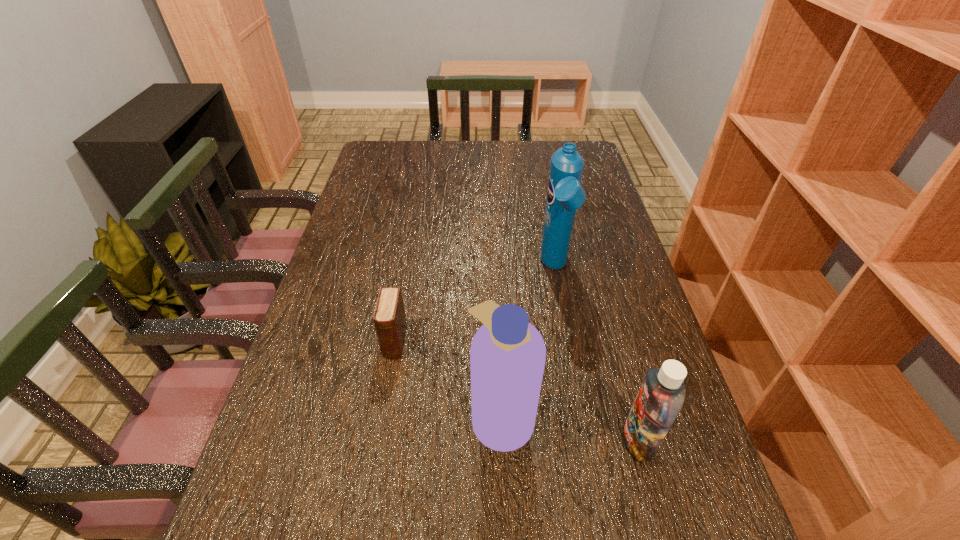
Locate an element on the screen. The image size is (960, 540). vacant area that lies between the shortest shampoo and the second shampoo from left to right is located at coordinates (596, 354).

This screenshot has width=960, height=540. In order to click on empty location between the third tallest object and the farthest object in this screenshot , I will do `click(596, 354)`.

In order to click on vacant space that is in between the rightmost shampoo and the leftmost shampoo in this screenshot , I will do `click(570, 428)`.

What are the coordinates of `free space between the shortest shampoo and the second object from right to left` in the screenshot? It's located at (596, 354).

You are a GUI agent. You are given a task and a screenshot of the screen. Output one action in this format:
    pyautogui.click(x=<x>, y=<y>)
    Task: Click on the empty location between the rightmost object and the farthest shampoo
    
    Given the screenshot: What is the action you would take?
    pyautogui.click(x=596, y=354)

Find the location of a particular element. The image size is (960, 540). vacant space in between the third object from right to left and the diary is located at coordinates (448, 379).

I want to click on blank region between the rightmost shampoo and the second object from left to right, so click(x=570, y=428).

Select which object is the third closest to the second object from right to left. Please provide its 2D coordinates. Your answer should be formatted as a tuple, i.e. [(x, y)], where the tuple contains the x and y coordinates of a point satisfying the conditions above.

[(389, 317)]

This screenshot has width=960, height=540. In order to click on object that stands as the third closest to the diary in this screenshot , I will do `click(661, 396)`.

This screenshot has height=540, width=960. Find the location of `shampoo that is the second closest to the farthest shampoo`. shampoo that is the second closest to the farthest shampoo is located at coordinates (661, 396).